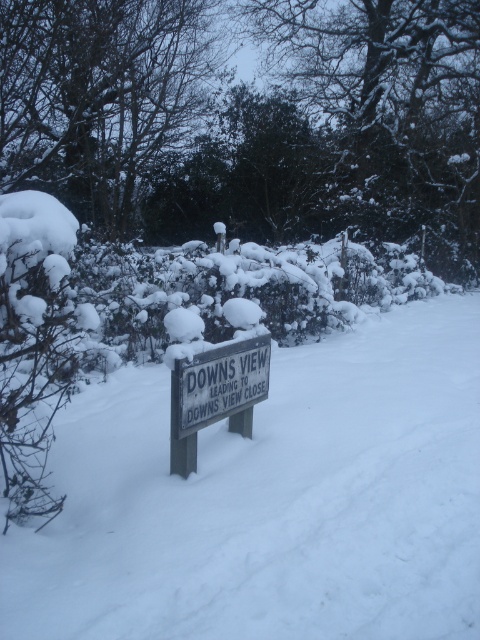
Question: Among these points, which one is nearest to the camera?

Choices:
 (A) (444, 72)
 (B) (120, 68)

Answer: (B)

Question: Can you confirm if snow-covered tree at center is wider than white wooden sign at center?

Choices:
 (A) yes
 (B) no

Answer: (B)

Question: Is snow-covered tree at upper center above white wooden sign at center?

Choices:
 (A) no
 (B) yes

Answer: (B)

Question: Where is snow-covered tree at center located in relation to white wooden sign at center in the image?

Choices:
 (A) above
 (B) below

Answer: (A)

Question: Which point is closer to the camera taking this photo?

Choices:
 (A) (62, 51)
 (B) (179, 412)
 (C) (466, 154)

Answer: (B)

Question: Among these objects, which one is nearest to the camera?

Choices:
 (A) snow-covered tree at upper center
 (B) white wooden sign at center

Answer: (B)